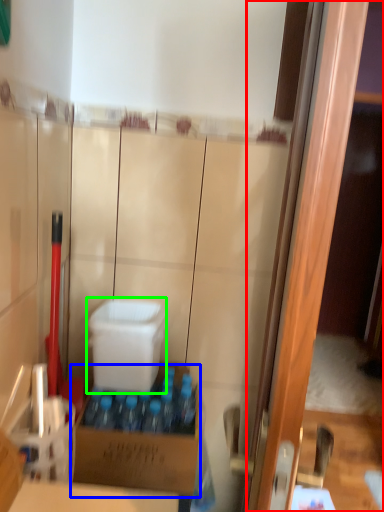
Question: Based on their relative distances, which object is nearer to screen door (highlighted by a red box)? Choose from box (highlighted by a blue box) and box (highlighted by a green box).

Choices:
 (A) box
 (B) box

Answer: (A)